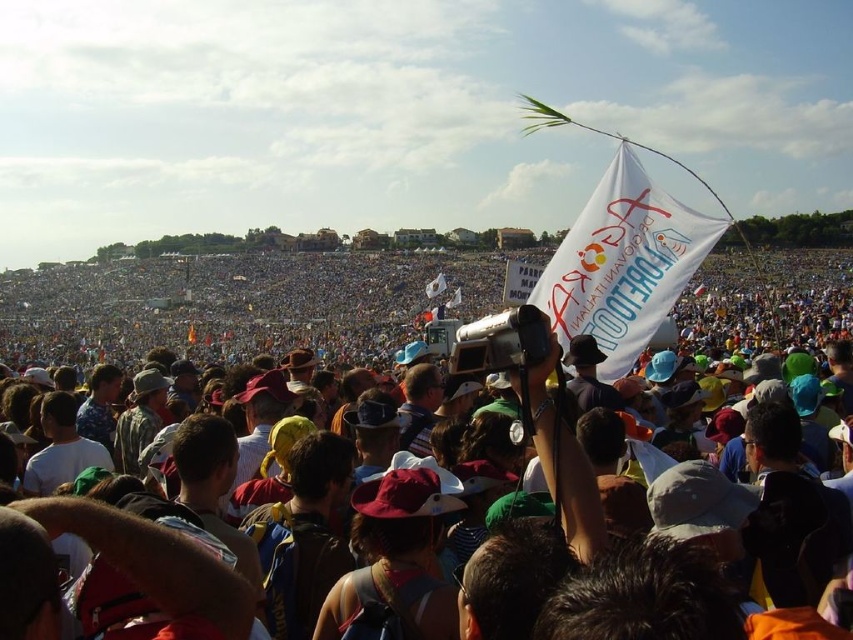
You are a photographer at the event and want to capture both the white flag with colorful text and graphics in the foreground and a distant landmark visible through the crowd. The flag is located at point (252, 317) and the landmark is at point (653, 275). Can you frame both in the same shot without moving your position?

Point (252, 317) is closer to the camera than point (653, 275). Since the flag is closer and the landmark is farther away, they are at different depths. Depending on your lens and focus, you might be able to capture both in the same frame, but the depth difference may affect focus. Adjust your aperture for a deeper depth of field to include both in sharpness.

You are a photographer at the event and want to capture the white paper flag at center in your shot. The flag is located at coordinates point [231,307]. If your camera has a zoom lens that can focus on objects within a radius of 0.1 units from the center, will the flag be in focus?

The point [231,307] is within the radius of 0.1 units from the center, so the flag will be in focus.

Where is the white paper flag at center located in the image?

The white paper flag at center is located at point (231,307) in the image.